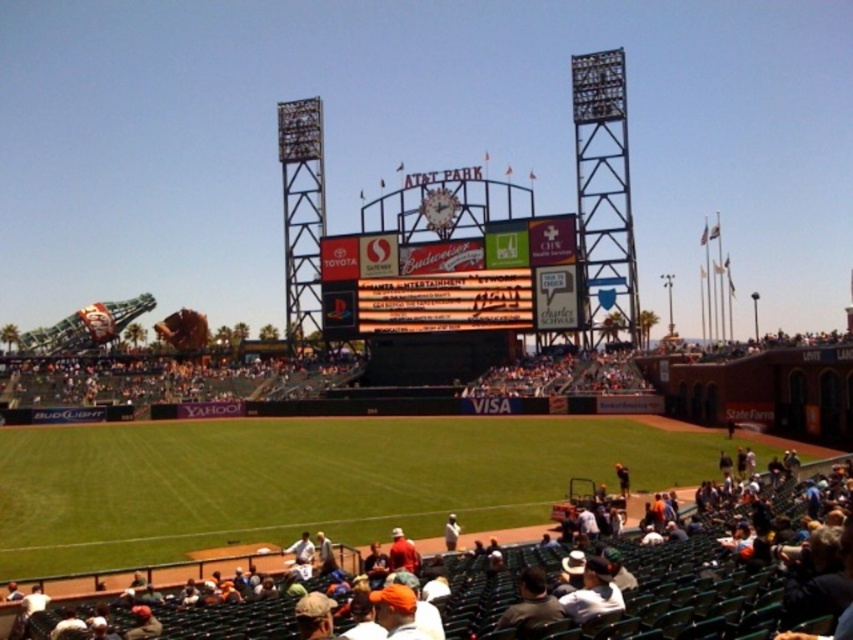
You are a photographer at AT T Park and want to capture both the dark gray shirt at lower center and the white jersey at center in a single shot. Which of the two should you focus on to ensure the larger one is in sharp focus?

The dark gray shirt at lower center has a larger size compared to the white jersey at center, so you should focus on the dark gray shirt at lower center to ensure the larger one is in sharp focus.

You are standing at the point labeled point (399,547) and want to walk towards the point labeled point (509,625). Which direction should you move to get closer to your destination?

You should move forward because point (509,625) is closer to the camera than point (399,547), meaning it is in front of you.

You are a photographer at AT T Park and want to capture both the dark gray shirt at lower center and the orange fabric cap at lower center in a single shot. Which object should you adjust your camera to focus on first to ensure both are in frame?

The orange fabric cap at lower center is to the left of dark gray shirt at lower center. To capture both in a single shot, focus on the orange fabric cap at lower center first as it is on the left side, allowing the dark gray shirt at lower center to be included to its right.